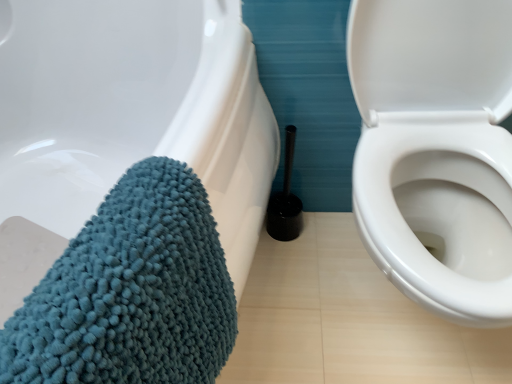
You are a GUI agent. You are given a task and a screenshot of the screen. Output one action in this format:
    pyautogui.click(x=<x>, y=<y>)
    Task: Click on the black plastic toilet brush at center
    This screenshot has width=512, height=384.
    Given the screenshot: What is the action you would take?
    pyautogui.click(x=285, y=199)

What do you see at coordinates (285, 199) in the screenshot? I see `black plastic toilet brush at center` at bounding box center [285, 199].

Describe the element at coordinates (131, 292) in the screenshot. The height and width of the screenshot is (384, 512). I see `teal chenille bath towel at lower left` at that location.

The image size is (512, 384). Identify the location of teal chenille bath towel at lower left. (131, 292).

You are a GUI agent. You are given a task and a screenshot of the screen. Output one action in this format:
    pyautogui.click(x=<x>, y=<y>)
    Task: Click on the black plastic toilet brush at center
    
    Given the screenshot: What is the action you would take?
    pyautogui.click(x=285, y=199)

From the picture: Between teal chenille bath towel at lower left and black plastic toilet brush at center, which one appears on the left side from the viewer's perspective?

teal chenille bath towel at lower left.

Is the position of teal chenille bath towel at lower left more distant than that of black plastic toilet brush at center?

No, it is not.

Is point (145, 181) positioned before point (287, 230)?

Yes, it is.

From the image's perspective, is teal chenille bath towel at lower left located above black plastic toilet brush at center?

No, from the image's perspective, teal chenille bath towel at lower left is not over black plastic toilet brush at center.

From a real-world perspective, is teal chenille bath towel at lower left on black plastic toilet brush at center?

Yes, from a real-world perspective, teal chenille bath towel at lower left is on top of black plastic toilet brush at center.

Which of these two, teal chenille bath towel at lower left or black plastic toilet brush at center, is thinner?

With smaller width is black plastic toilet brush at center.

Does teal chenille bath towel at lower left have a greater height compared to black plastic toilet brush at center?

Yes.

Between teal chenille bath towel at lower left and black plastic toilet brush at center, which one has smaller size?

black plastic toilet brush at center is smaller.

Would you say teal chenille bath towel at lower left contains black plastic toilet brush at center?

That's incorrect, black plastic toilet brush at center is not inside teal chenille bath towel at lower left.

Is teal chenille bath towel at lower left not close to black plastic toilet brush at center?

No, teal chenille bath towel at lower left is not far away from black plastic toilet brush at center.

Based on the photo, is teal chenille bath towel at lower left looking in the opposite direction of black plastic toilet brush at center?

No, teal chenille bath towel at lower left is not facing away from black plastic toilet brush at center.

How different are the orientations of teal chenille bath towel at lower left and black plastic toilet brush at center in degrees?

The angle between the facing direction of teal chenille bath towel at lower left and the facing direction of black plastic toilet brush at center is 64.1 degrees.

Identify the location of brush located on the right of teal chenille bath towel at lower left. The width and height of the screenshot is (512, 384). (285, 199).

Is black plastic toilet brush at center to the left or to the right of teal chenille bath towel at lower left in the image?

black plastic toilet brush at center is to the right of teal chenille bath towel at lower left.

Considering their positions, is black plastic toilet brush at center located in front of or behind teal chenille bath towel at lower left?

black plastic toilet brush at center is positioned farther from the viewer than teal chenille bath towel at lower left.

Which is closer to the camera, (x=294, y=133) or (x=122, y=299)?

Point (x=294, y=133) is positioned farther from the camera compared to point (x=122, y=299).

From the image's perspective, is black plastic toilet brush at center beneath teal chenille bath towel at lower left?

No.

From a real-world perspective, is black plastic toilet brush at center positioned above or below teal chenille bath towel at lower left?

black plastic toilet brush at center is below teal chenille bath towel at lower left.

Does black plastic toilet brush at center have a lesser width compared to teal chenille bath towel at lower left?

Indeed, black plastic toilet brush at center has a lesser width compared to teal chenille bath towel at lower left.

Can you confirm if black plastic toilet brush at center is taller than teal chenille bath towel at lower left?

No.

Is black plastic toilet brush at center smaller than teal chenille bath towel at lower left?

Yes, black plastic toilet brush at center is smaller than teal chenille bath towel at lower left.

Would you say black plastic toilet brush at center is inside or outside teal chenille bath towel at lower left?

black plastic toilet brush at center is not enclosed by teal chenille bath towel at lower left.

Is black plastic toilet brush at center far away from teal chenille bath towel at lower left?

No.

Is black plastic toilet brush at center aimed at teal chenille bath towel at lower left?

No, black plastic toilet brush at center does not turn towards teal chenille bath towel at lower left.

How many degrees apart are the facing directions of black plastic toilet brush at center and teal chenille bath towel at lower left?

64.1 degrees separate the facing orientations of black plastic toilet brush at center and teal chenille bath towel at lower left.

Identify the location of brush on the right of teal chenille bath towel at lower left. The height and width of the screenshot is (384, 512). (285, 199).

Identify the location of brush above the teal chenille bath towel at lower left (from the image's perspective). (285, 199).

Where is `bath towel on the left side of black plastic toilet brush at center`? The height and width of the screenshot is (384, 512). bath towel on the left side of black plastic toilet brush at center is located at coordinates (131, 292).